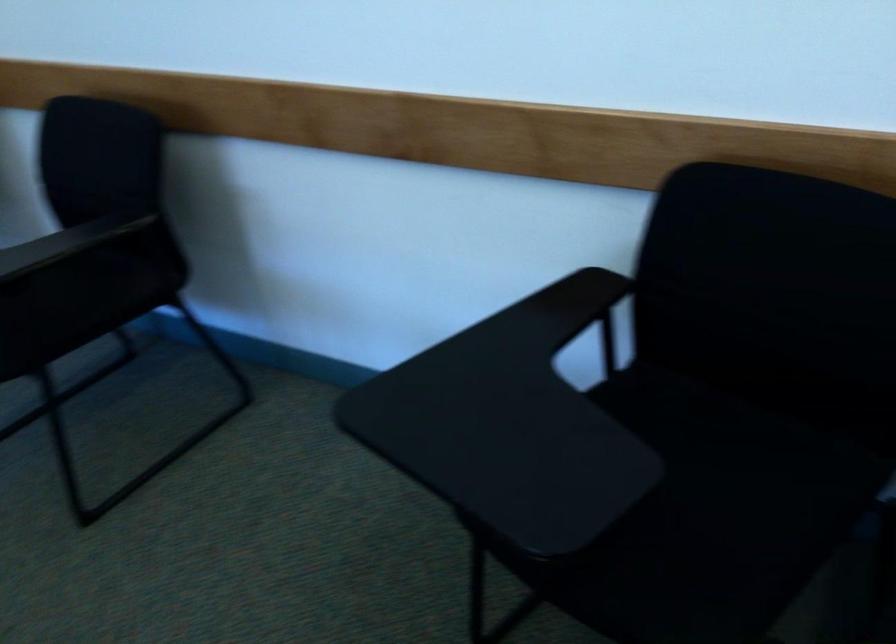
Find where to rest the black chair armrest. Please return your answer as a coordinate pair (x, y).

(67, 241)